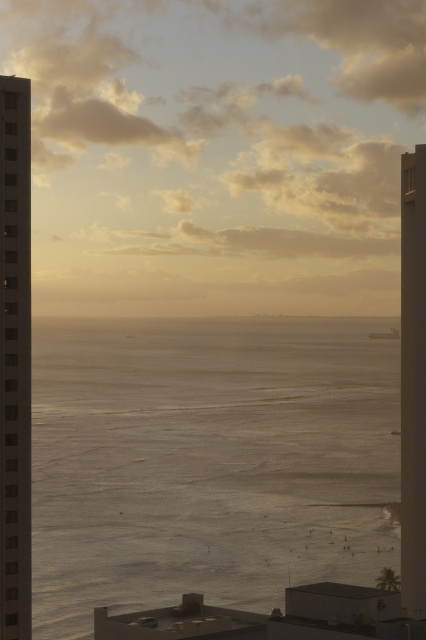
Question: Does golden water at center have a greater width compared to smooth glass tower at right?

Choices:
 (A) yes
 (B) no

Answer: (A)

Question: Where is smooth concrete tower at left located in relation to smooth glass tower at right in the image?

Choices:
 (A) above
 (B) below

Answer: (A)

Question: Does smooth concrete tower at left come in front of smooth glass tower at right?

Choices:
 (A) yes
 (B) no

Answer: (A)

Question: Which point appears farthest from the camera in this image?

Choices:
 (A) (284, 500)
 (B) (25, 506)
 (C) (420, 310)

Answer: (A)

Question: Which is nearer to the golden water at center?

Choices:
 (A) smooth concrete tower at left
 (B) smooth glass tower at right

Answer: (B)

Question: Among these points, which one is farthest from the camera?

Choices:
 (A) (405, 234)
 (B) (14, 616)
 (C) (304, 353)

Answer: (C)